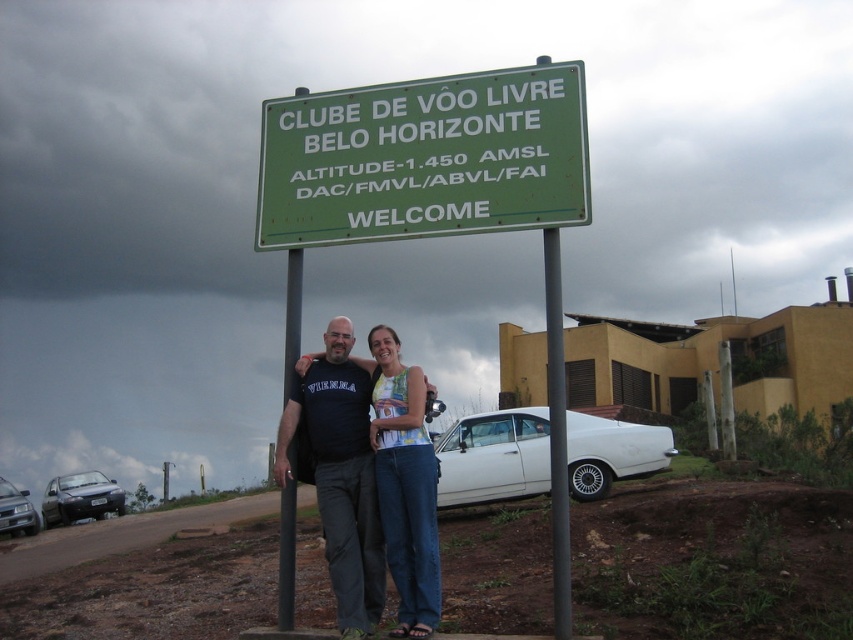
Based on the photo, you are a photographer planning to capture a wide shot of the entrance of the Clube de Voo Livre Belo Horizonte. You need to include both the denim pants at center and the matte black sedan at lower left in your frame. Given their sizes, which object should you focus on to ensure both are clearly visible in the photo?

The denim pants at center has a smaller size compared to the matte black sedan at lower left. To ensure both are clearly visible, focus on the matte black sedan at lower left since it is larger and will remain in focus while the smaller denim pants at center will also be captured within the frame.

You are a pilot preparing to land a small aircraft that requires a minimum runway length of 100 feet. You observe the green plastic sign at center and the silver metallic sedan at lower left. Based on the distance between them, can you determine if the available space between these two objects is sufficient for your landing? Please provide your answer with reasoning.

The distance between the green plastic sign at center and the silver metallic sedan at lower left is 80.72 feet. Since the required minimum runway length is 100 feet, the available space is insufficient for landing.

You are a photographer planning to capture the signboard at the entrance of the club. You notice a gray metallic pole at center and a matte black sedan at lower left in the frame. Based on their widths, which object would appear narrower in your photo?

The gray metallic pole at center is narrower than the matte black sedan at lower left because its width is less than the sedan.